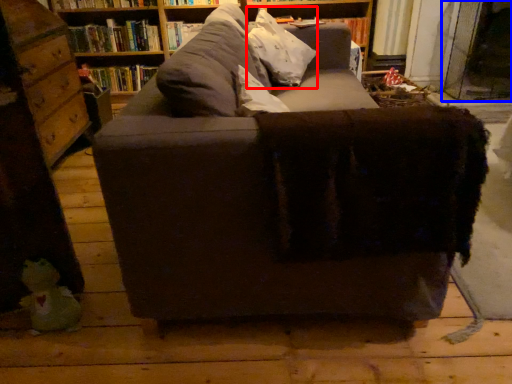
Question: Which object is closer to the camera taking this photo, throw pillow (highlighted by a red box) or glass door (highlighted by a blue box)?

Choices:
 (A) throw pillow
 (B) glass door

Answer: (A)